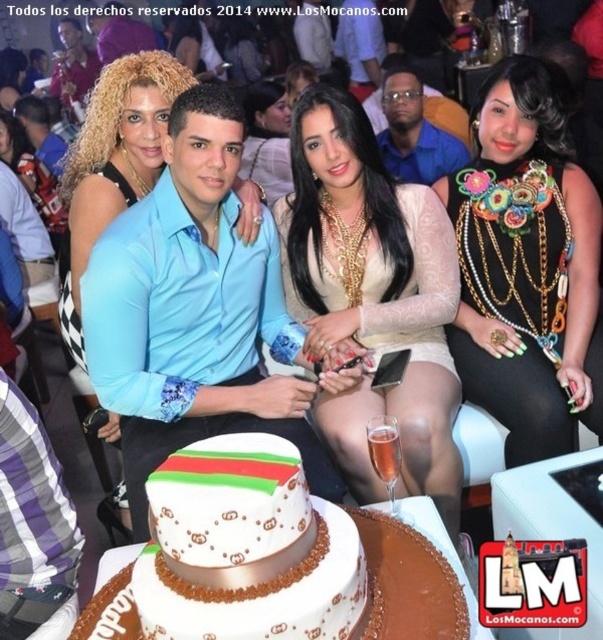
Question: Is light blue shirt at center thinner than white fondant cake at center?

Choices:
 (A) yes
 (B) no

Answer: (B)

Question: Which of the following is the farthest from the observer?

Choices:
 (A) smooth beige dress at center
 (B) blue shirt at center

Answer: (A)

Question: Does light blue shirt at center have a larger size compared to white fondant cake at center?

Choices:
 (A) no
 (B) yes

Answer: (B)

Question: Can you confirm if light blue shirt at center is smaller than white fondant cake at center?

Choices:
 (A) yes
 (B) no

Answer: (B)

Question: Based on their relative distances, which object is farther from the white fondant cake at center?

Choices:
 (A) black fabric dress at center
 (B) smooth beige dress at center
 (C) white lace dress at center

Answer: (B)

Question: Estimate the real-world distances between objects in this image. Which object is farther from the light blue shirt at center?

Choices:
 (A) black fabric dress at center
 (B) smooth beige dress at center

Answer: (B)